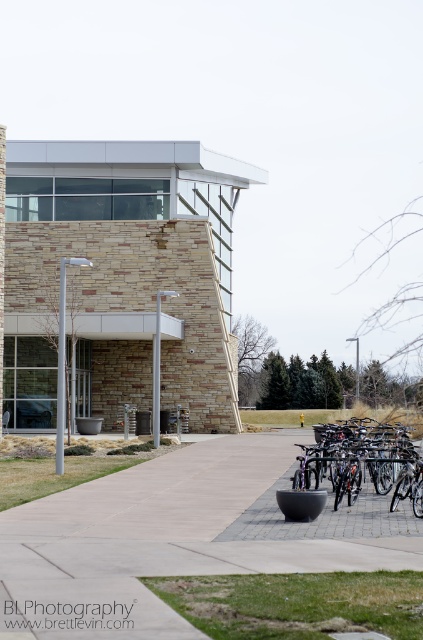
Question: Is gray concrete pavement at center wider than shiny metallic bicycles at lower right?

Choices:
 (A) yes
 (B) no

Answer: (A)

Question: Is gray concrete pavement at center bigger than shiny metallic bicycles at lower right?

Choices:
 (A) no
 (B) yes

Answer: (B)

Question: Which object appears closest to the camera in this image?

Choices:
 (A) gray concrete pavement at center
 (B) shiny metallic bicycles at lower right

Answer: (A)

Question: Is gray concrete pavement at center thinner than shiny metallic bicycles at lower right?

Choices:
 (A) no
 (B) yes

Answer: (A)

Question: Which point is farther to the camera?

Choices:
 (A) gray concrete pavement at center
 (B) shiny metallic bicycles at lower right

Answer: (B)

Question: Among these objects, which one is farthest from the camera?

Choices:
 (A) shiny metallic bicycles at lower right
 (B) gray concrete pavement at center

Answer: (A)